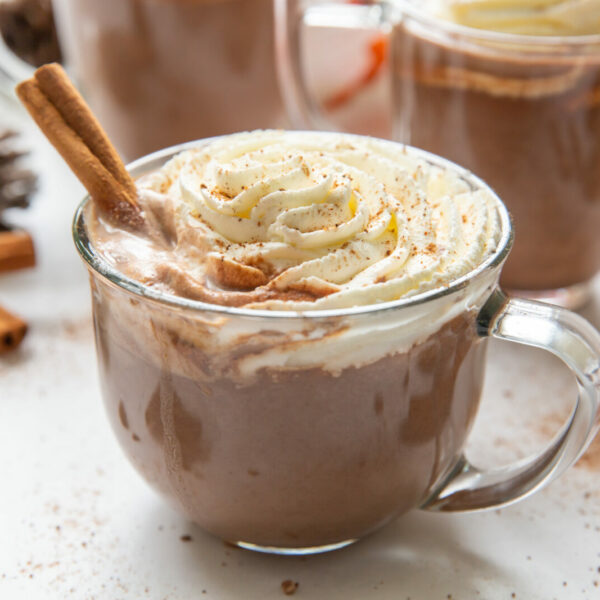
Identify the location of white table. This screenshot has width=600, height=600. (76, 512).